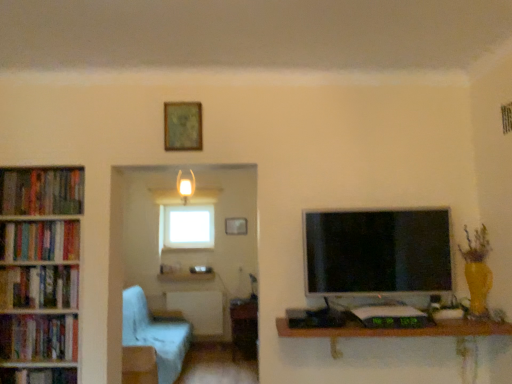
Where is `blank space situated above hardcover books at left, the fourth book in the bottom-to-top sequence (from a real-world perspective)`? blank space situated above hardcover books at left, the fourth book in the bottom-to-top sequence (from a real-world perspective) is located at coordinates point(32,220).